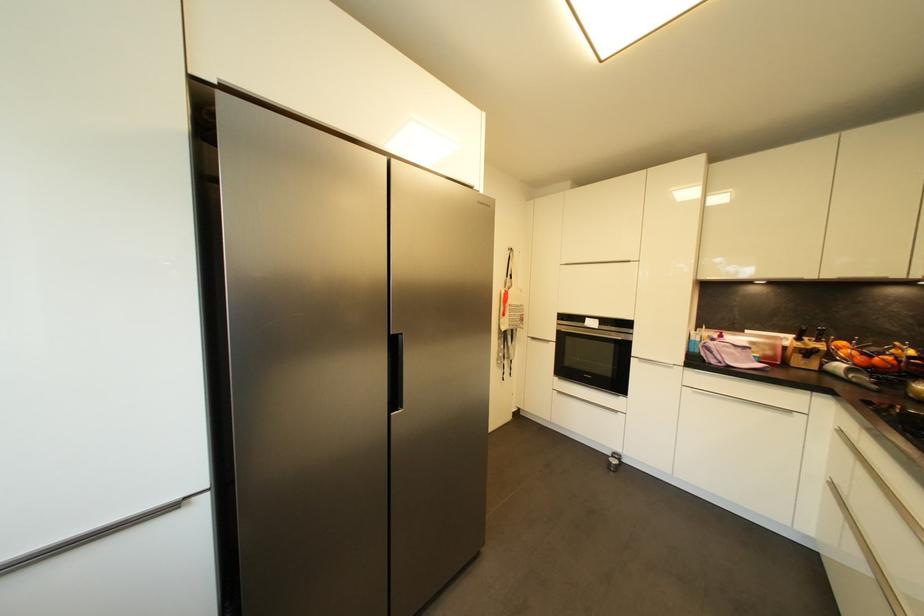
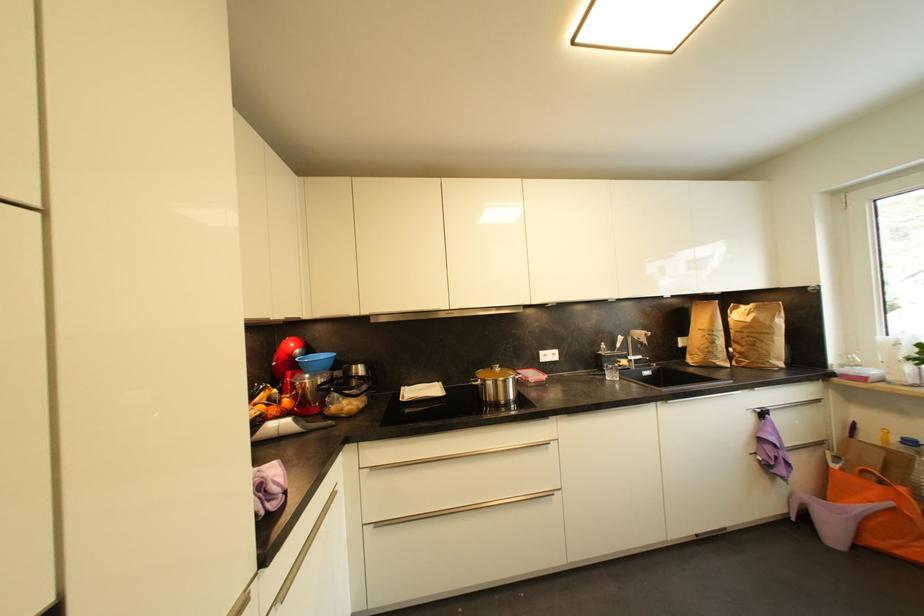
Question: I am providing you with two images of the same scene from different viewpoints. After the viewpoint changes to image2, which objects are now occluded?

Choices:
 (A) metal drawer handle
 (B) brown paper bag
 (C) blue bowl
 (D) none of these

Answer: (D)